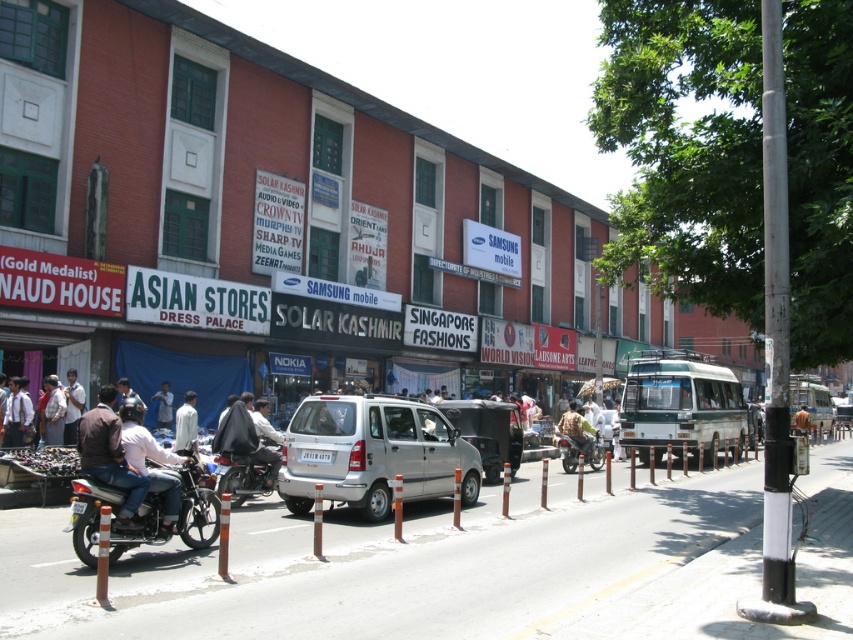
Who is shorter, matte black van at center or white matte shirt at center?

white matte shirt at center

Does matte black van at center have a greater height compared to white matte shirt at center?

Yes.

Image resolution: width=853 pixels, height=640 pixels. What do you see at coordinates (488, 432) in the screenshot?
I see `matte black van at center` at bounding box center [488, 432].

Where is `matte black van at center`? Image resolution: width=853 pixels, height=640 pixels. matte black van at center is located at coordinates (488, 432).

Who is shorter, matte black van at center or metallic silver motorcycle at center?

With less height is metallic silver motorcycle at center.

Which is below, matte black van at center or metallic silver motorcycle at center?

metallic silver motorcycle at center is below.

Is point (466, 417) farther from camera compared to point (570, 442)?

That is False.

Where is `matte black van at center`? The height and width of the screenshot is (640, 853). matte black van at center is located at coordinates (488, 432).

Which is above, light blue jeans at lower left or white matte shirt at center?

Positioned higher is light blue jeans at lower left.

Who is positioned more to the left, light blue jeans at lower left or white matte shirt at center?

white matte shirt at center

What do you see at coordinates (151, 458) in the screenshot?
I see `light blue jeans at lower left` at bounding box center [151, 458].

In order to click on light blue jeans at lower left in this screenshot , I will do `click(151, 458)`.